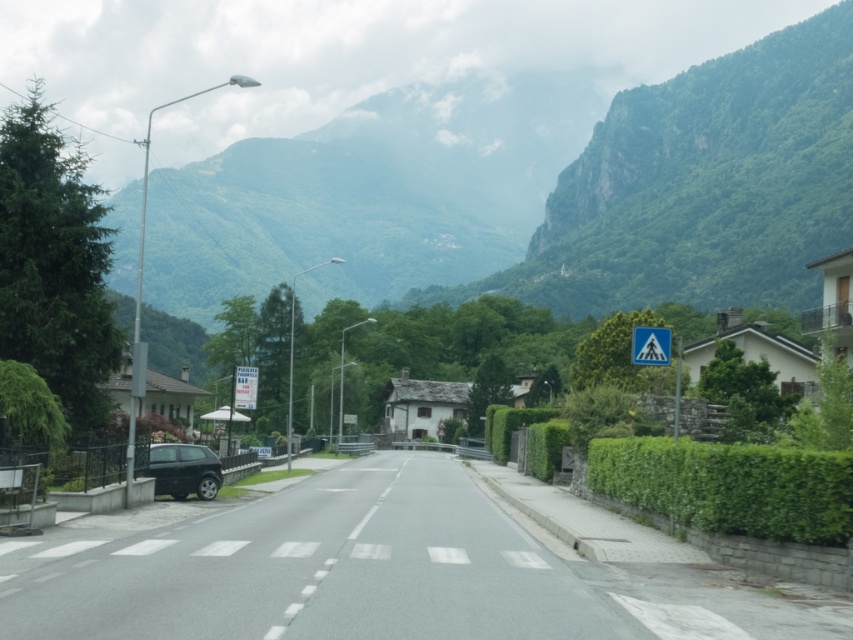
Can you confirm if green rocky mountain at upper center is positioned above white plastic pedestrian crossing sign at right?

Yes, green rocky mountain at upper center is above white plastic pedestrian crossing sign at right.

Is green rocky mountain at upper center in front of white plastic pedestrian crossing sign at right?

No, it is behind white plastic pedestrian crossing sign at right.

Where is `green rocky mountain at upper center`? The height and width of the screenshot is (640, 853). green rocky mountain at upper center is located at coordinates (701, 186).

Between shiny black car at lower left and white plastic pedestrian crossing sign at right, which one has less height?

Standing shorter between the two is white plastic pedestrian crossing sign at right.

The height and width of the screenshot is (640, 853). Identify the location of shiny black car at lower left. (184, 470).

Who is more forward, (194, 483) or (659, 336)?

Point (659, 336)

The image size is (853, 640). What are the coordinates of `shiny black car at lower left` in the screenshot? It's located at (184, 470).

Who is more forward, (665,332) or (238,376)?

Point (665,332) is in front.

Which is in front, point (641, 336) or point (251, 404)?

Point (641, 336) is in front.

Where is `white plastic pedestrian crossing sign at right`? The image size is (853, 640). white plastic pedestrian crossing sign at right is located at coordinates (650, 346).